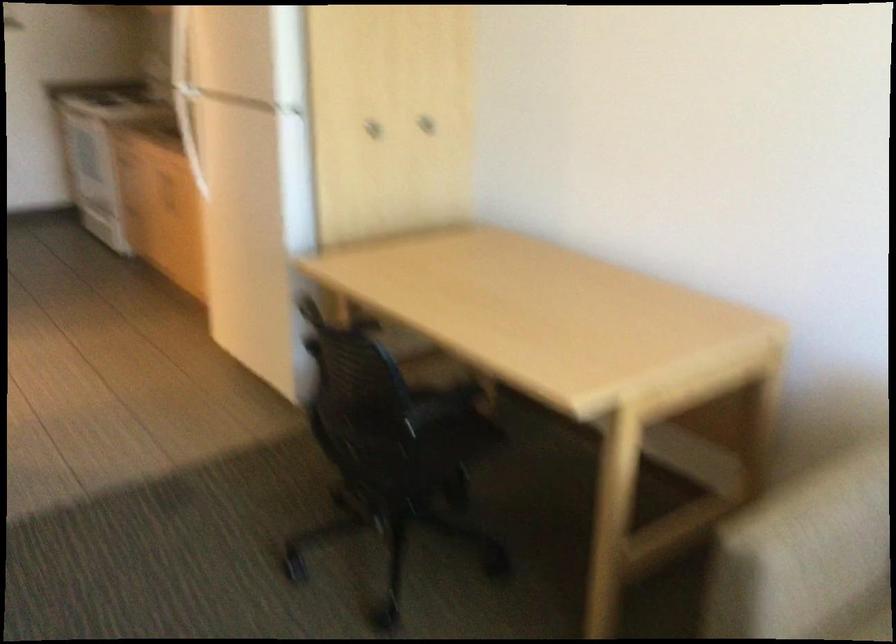
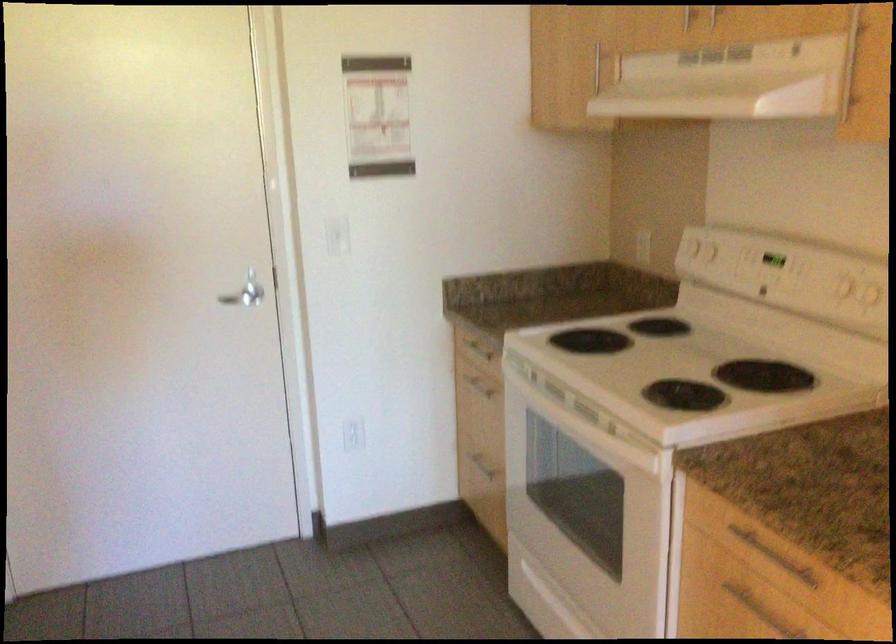
Find the pixel in the second image that matches (154,102) in the first image.

(686, 365)